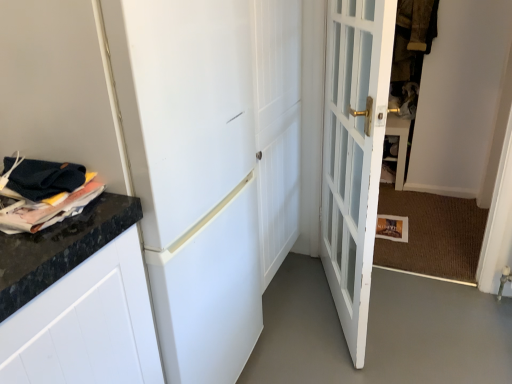
Question: Considering the relative positions of white glossy door at center, which is counted as the second door, starting from the right, and matte black magazine at left in the image provided, is white glossy door at center, which is counted as the second door, starting from the right, behind matte black magazine at left?

Choices:
 (A) no
 (B) yes

Answer: (A)

Question: Is white glossy door at center, which is counted as the second door, starting from the right, wider than matte black magazine at left?

Choices:
 (A) yes
 (B) no

Answer: (A)

Question: Does white glossy door at center, positioned as the 1th door in left-to-right order, have a larger size compared to matte black magazine at left?

Choices:
 (A) yes
 (B) no

Answer: (A)

Question: Could you tell me if white glossy door at center, which is counted as the second door, starting from the right, is facing matte black magazine at left?

Choices:
 (A) no
 (B) yes

Answer: (A)

Question: Does white glossy door at center, which is counted as the second door, starting from the right, have a greater height compared to matte black magazine at left?

Choices:
 (A) no
 (B) yes

Answer: (B)

Question: Is white glossy door at center, which is counted as the second door, starting from the right, directly adjacent to matte black magazine at left?

Choices:
 (A) no
 (B) yes

Answer: (A)

Question: Considering the relative positions of matte black magazine at left and white glossy door at center, which is counted as the second door, starting from the right, in the image provided, is matte black magazine at left to the right of white glossy door at center, which is counted as the second door, starting from the right, from the viewer's perspective?

Choices:
 (A) yes
 (B) no

Answer: (B)

Question: Is matte black magazine at left looking in the opposite direction of white glossy door at center, which is counted as the second door, starting from the right?

Choices:
 (A) no
 (B) yes

Answer: (A)

Question: Does matte black magazine at left have a smaller size compared to white glossy door at center, which is counted as the second door, starting from the right?

Choices:
 (A) yes
 (B) no

Answer: (A)

Question: Does matte black magazine at left have a greater height compared to white glossy door at center, which is counted as the second door, starting from the right?

Choices:
 (A) yes
 (B) no

Answer: (B)

Question: Is matte black magazine at left further to camera compared to white glossy door at center, positioned as the 1th door in left-to-right order?

Choices:
 (A) yes
 (B) no

Answer: (A)

Question: From the image's perspective, is matte black magazine at left located beneath white glossy door at center, which is counted as the second door, starting from the right?

Choices:
 (A) yes
 (B) no

Answer: (B)

Question: Considering the relative sizes of white glass door at center, which is the 2th door in left-to-right order, and brown textured fabric at upper right in the image provided, is white glass door at center, which is the 2th door in left-to-right order, wider than brown textured fabric at upper right?

Choices:
 (A) no
 (B) yes

Answer: (A)